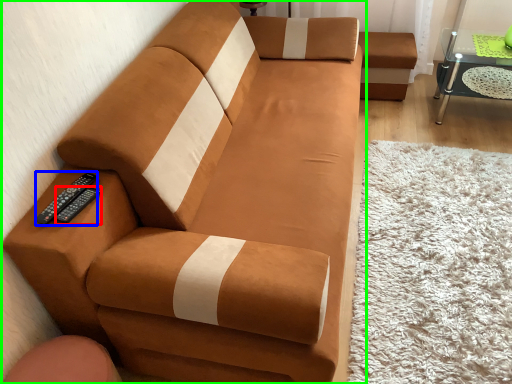
Question: Considering the real-world distances, which object is farthest from remote (highlighted by a red box)? remote (highlighted by a blue box) or studio couch (highlighted by a green box)?

Choices:
 (A) remote
 (B) studio couch

Answer: (B)